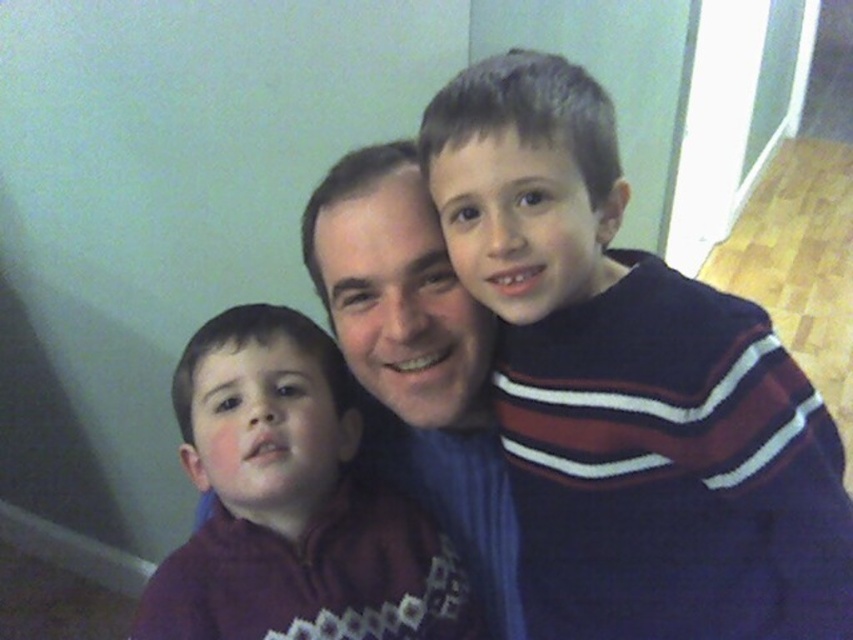
Question: Which of these objects is positioned closest to the purple fleece jacket at left?

Choices:
 (A) dark blue sweater at right
 (B) matte blue sweater at center

Answer: (B)

Question: Which object is the closest to the dark blue sweater at right?

Choices:
 (A) matte blue sweater at center
 (B) purple fleece jacket at left

Answer: (A)

Question: Does dark blue sweater at right appear under purple fleece jacket at left?

Choices:
 (A) no
 (B) yes

Answer: (A)

Question: Considering the relative positions of dark blue sweater at right and matte blue sweater at center in the image provided, where is dark blue sweater at right located with respect to matte blue sweater at center?

Choices:
 (A) right
 (B) left

Answer: (A)

Question: Which of these objects is positioned closest to the matte blue sweater at center?

Choices:
 (A) purple fleece jacket at left
 (B) dark blue sweater at right

Answer: (A)

Question: Does purple fleece jacket at left appear over matte blue sweater at center?

Choices:
 (A) yes
 (B) no

Answer: (B)